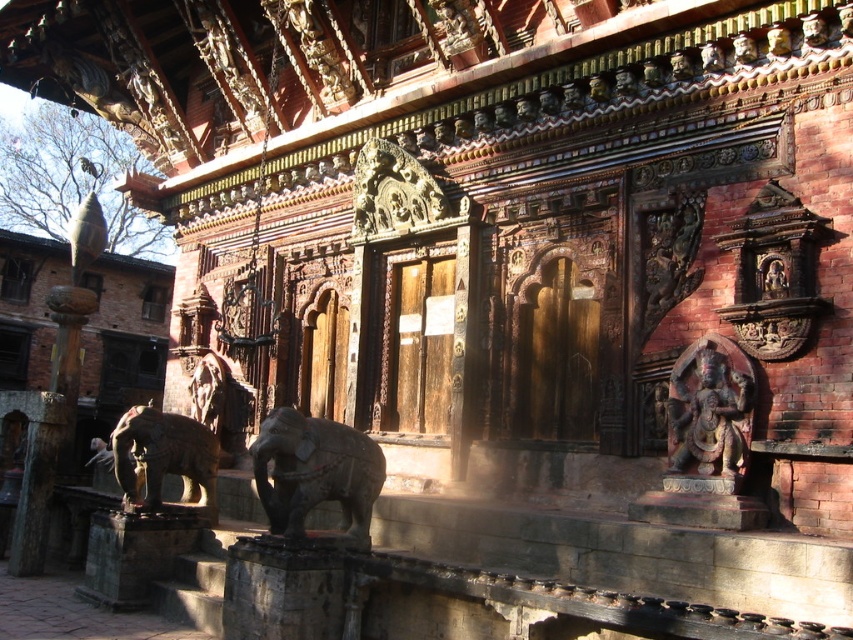
You are an art restorer examining the temple structure. You need to assess the placement of the polished red stone statue at right and the brown stone elephant at lower left. Which object is positioned higher in the structure?

The polished red stone statue at right is positioned higher than the brown stone elephant at lower left as it is located above it.

You are an art conservator examining the temple structure. You notice the polished red stone statue at right and the carved wood statue at center. Which statue is closer to you, the conservator?

The polished red stone statue at right is closer to you because it is in front of the carved wood statue at center.